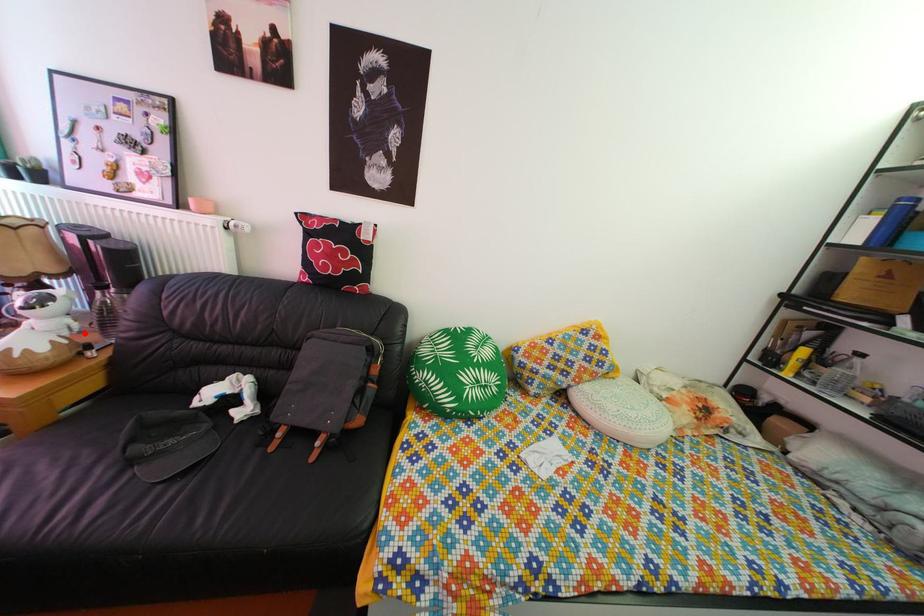
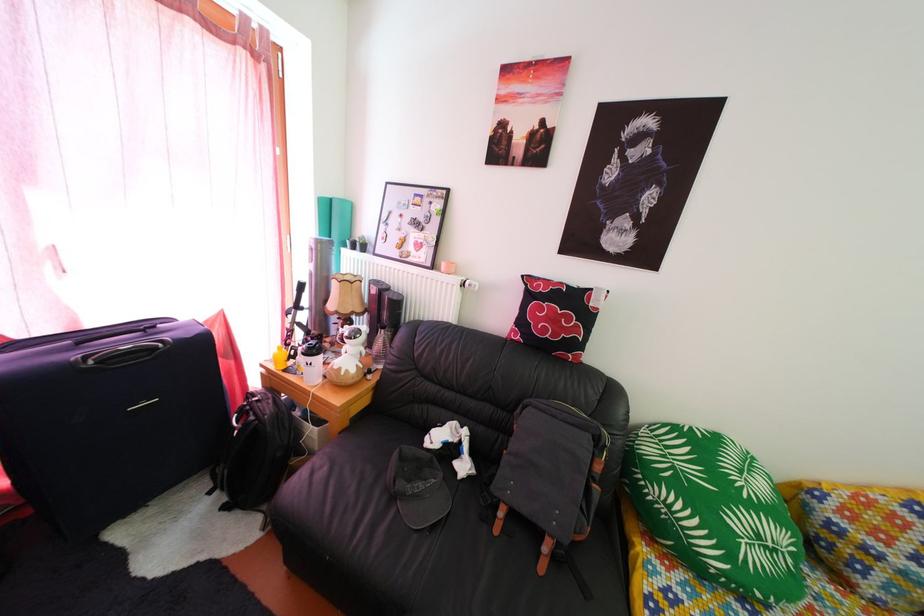
The point at the highlighted location is marked in the first image. Where is the corresponding point in the second image?

(372, 361)